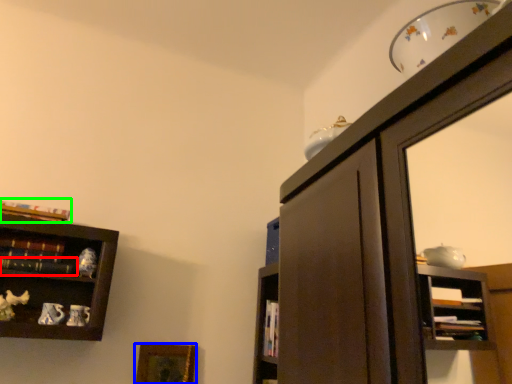
Question: Which is farther away from book (highlighted by a red box)? picture frame (highlighted by a blue box) or book (highlighted by a green box)?

Choices:
 (A) picture frame
 (B) book

Answer: (A)